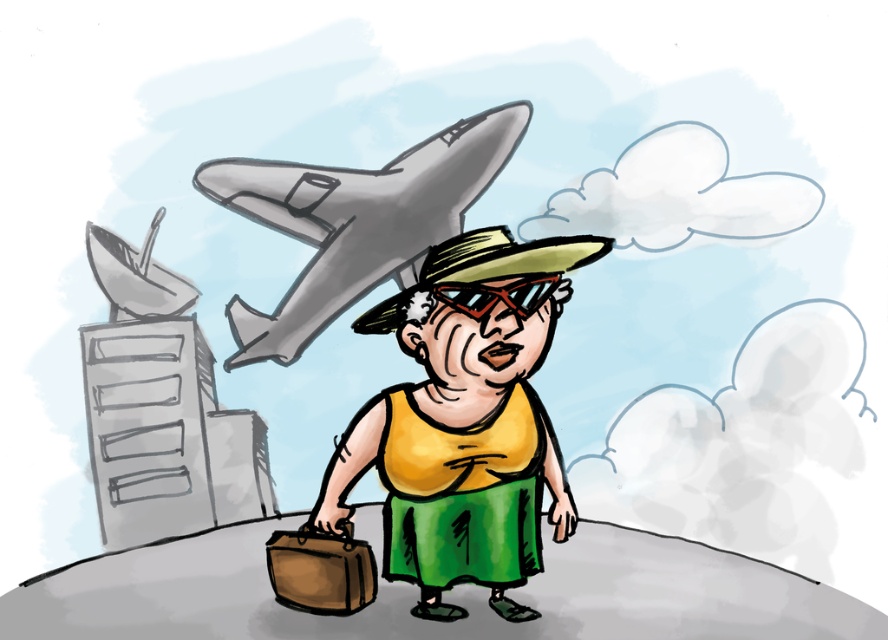
You are standing at the origin point in the image and see two points labeled as point (604, 253) and point (238, 173). Which point is closer to you?

Point (604, 253) is in front of point (238, 173), so it is closer to you.

You are standing in the scene and want to take a photo of the gray metallic airplane at upper center. To ensure the airplane is centered in your photo, where should you aim your camera? Use the coordinate system where the bottom left corner is the origin and the top right corner is the maximum point. The airplane is located at point 0.347, 0.402. Please provide the coordinates as a pair of numbers between 0 and 1.

The gray metallic airplane at upper center is located at coordinates (355,221). To center it in the photo, aim the camera at those coordinates.

You are an airport security officer who just noticed the yellow fabric shirt at center and the gray metallic airplane at upper center in the image. Based on their sizes, which one do you think is more likely to be a real object in this scenario?

The gray metallic airplane at upper center is more likely to be a real object because the yellow fabric shirt at center is described as bigger, which is unusual for a shirt compared to an airplane in reality.